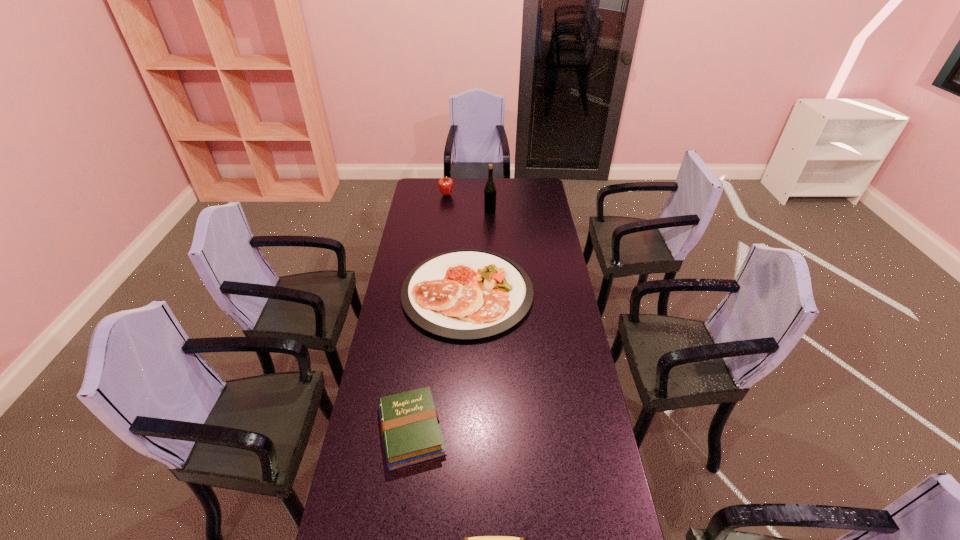
The width and height of the screenshot is (960, 540). In order to click on blank space at the far right corner in this screenshot , I will do `click(529, 198)`.

Locate an element on the screen. empty space between the second tallest object and the dish is located at coordinates (457, 244).

I want to click on free space that is in between the second farthest object and the fourth shortest object, so click(x=468, y=202).

I want to click on the third closest object to the fourth nearest object, so click(410, 427).

Identify which object is the second nearest to the apple. Please provide its 2D coordinates. Your answer should be formatted as a tuple, i.e. [(x, y)], where the tuple contains the x and y coordinates of a point satisfying the conditions above.

[(467, 294)]